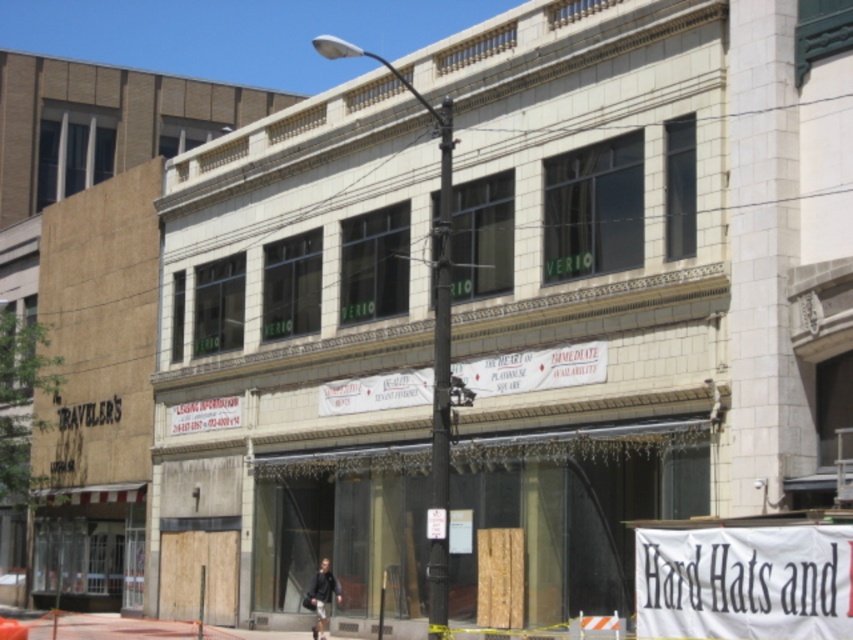
Is white fabric banner at lower right wider than dark gray jacket at center?

Yes, white fabric banner at lower right is wider than dark gray jacket at center.

Can you confirm if white fabric banner at lower right is bigger than dark gray jacket at center?

Yes, white fabric banner at lower right is bigger than dark gray jacket at center.

Identify the location of white fabric banner at lower right. Image resolution: width=853 pixels, height=640 pixels. (744, 580).